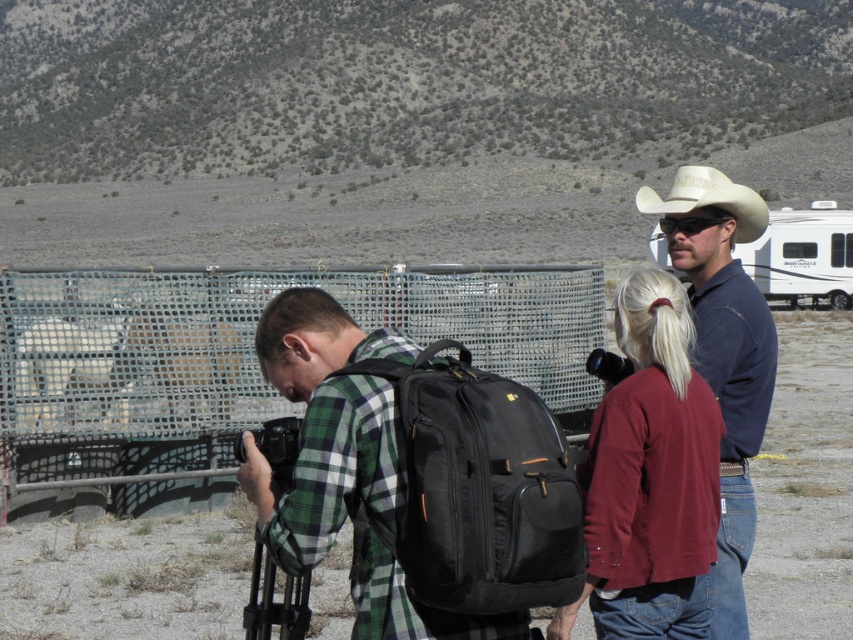
You are a hiker trying to determine the order of objects from closest to farthest. You see the metal mesh fence at center and the matte blue shirt at center. Which is closer to you?

The metal mesh fence at center is closer to you than the matte blue shirt at center.

Consider the image. You are a traveler in the desert and see the matte blue shirt at center and the white plastic recreational vehicle at upper right. Which object is closer to you?

Answer: The matte blue shirt at center is closer to you because it has a smaller size compared to the white plastic recreational vehicle at upper right.

You are planning to take a photo of the black fabric backpack at center and the white leather cowboy hat at upper right. Which object should you focus on first if you want to capture both in the same frame without moving the camera?

The black fabric backpack at center has a lesser height compared to the white leather cowboy hat at upper right, so you should focus on the white leather cowboy hat at upper right first because it is taller and may require more attention to ensure it fits within the frame.